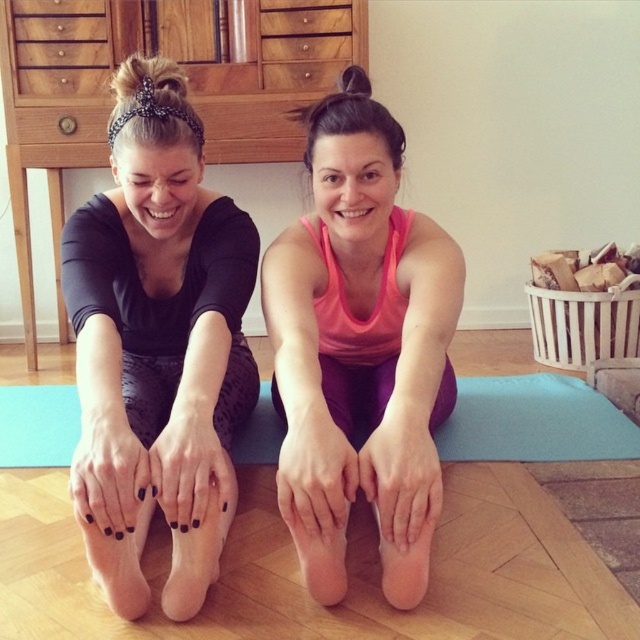
Is pink matte tank top at center below black matte foot at lower center?

No, pink matte tank top at center is not below black matte foot at lower center.

Is pink matte tank top at center shorter than black matte foot at lower center?

No, pink matte tank top at center is not shorter than black matte foot at lower center.

At what (x,y) coordinates should I click in order to perform the action: click on pink matte tank top at center. Please return your answer as a coordinate pair (x, y). Looking at the image, I should click on (360, 348).

Identify the location of pink matte tank top at center. (360, 348).

Which of these two, black matte foot at lower center or pink matte foot at center, stands taller?

black matte foot at lower center is taller.

Does black matte foot at lower center have a larger size compared to pink matte foot at center?

Yes, black matte foot at lower center is bigger than pink matte foot at center.

Image resolution: width=640 pixels, height=640 pixels. What do you see at coordinates (196, 556) in the screenshot? I see `black matte foot at lower center` at bounding box center [196, 556].

Locate an element on the screen. The image size is (640, 640). black matte foot at lower center is located at coordinates (196, 556).

Is pink matte tank top at center bigger than pink matte foot at center?

Yes.

Does pink matte tank top at center appear under pink matte foot at center?

No, pink matte tank top at center is not below pink matte foot at center.

Between point (387, 600) and point (392, 604), which one is positioned behind?

The point (387, 600) is behind.

Identify the location of pink matte tank top at center. The image size is (640, 640). (360, 348).